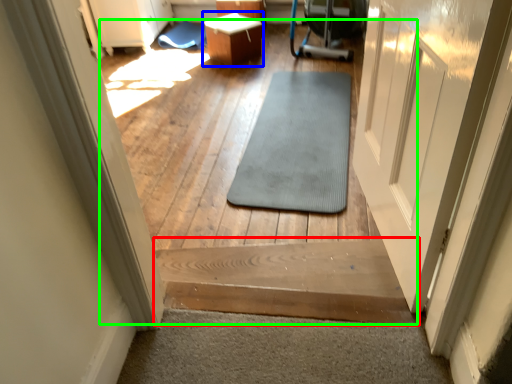
Question: Which object is the farthest from stairs (highlighted by a red box)? Choose among these: table (highlighted by a blue box) or path (highlighted by a green box).

Choices:
 (A) table
 (B) path

Answer: (A)